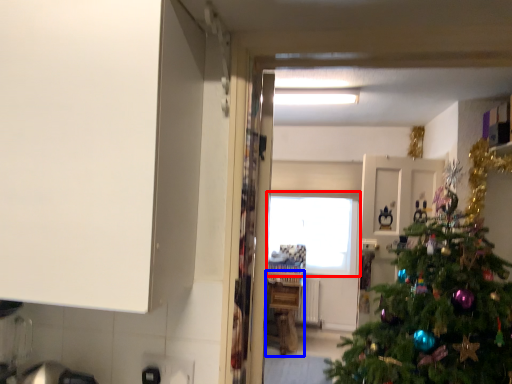
Question: Which of the following is the farthest to the observer, window (highlighted by a red box) or counter (highlighted by a blue box)?

Choices:
 (A) window
 (B) counter

Answer: (A)